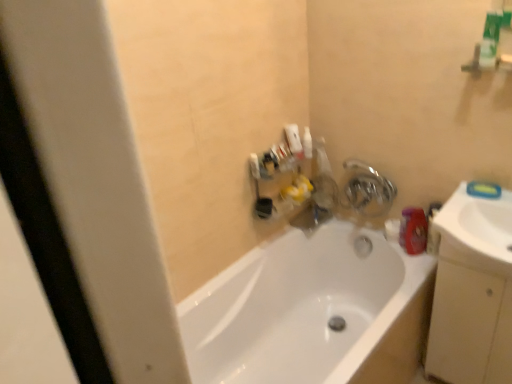
Image resolution: width=512 pixels, height=384 pixels. I want to click on metallic silver faucet at upper right, so click(367, 190).

This screenshot has height=384, width=512. What do you see at coordinates (311, 218) in the screenshot?
I see `matte plastic faucet at upper center` at bounding box center [311, 218].

Measure the distance between beige matte cabinet at right and camera.

The distance of beige matte cabinet at right from camera is 4.63 feet.

Find the location of a particular element. This screenshot has width=512, height=384. white glossy bathtub at center is located at coordinates (310, 313).

From the image's perspective, which is above, metallic silver faucet at upper right or matte plastic faucet at upper center?

metallic silver faucet at upper right appears higher in the image.

Are metallic silver faucet at upper right and matte plastic faucet at upper center located far from each other?

No, there isn't a large distance between metallic silver faucet at upper right and matte plastic faucet at upper center.

Which of these two, metallic silver faucet at upper right or matte plastic faucet at upper center, is smaller?

Smaller between the two is matte plastic faucet at upper center.

Between metallic silver faucet at upper right and matte plastic faucet at upper center, which one is positioned behind?

matte plastic faucet at upper center is further from the camera.

You are a GUI agent. You are given a task and a screenshot of the screen. Output one action in this format:
    pyautogui.click(x=<x>, y=<y>)
    Task: Click on the tap above the white glossy bathtub at center (from the image's perspective)
    This screenshot has width=512, height=384.
    Given the screenshot: What is the action you would take?
    pyautogui.click(x=367, y=190)

Is metallic silver faucet at upper right facing away from white glossy bathtub at center?

That's not correct — metallic silver faucet at upper right is not looking away from white glossy bathtub at center.

Is white glossy bathtub at center inside metallic silver faucet at upper right?

No, metallic silver faucet at upper right does not contain white glossy bathtub at center.

What's the angular difference between metallic silver faucet at upper right and white glossy bathtub at center's facing directions?

metallic silver faucet at upper right and white glossy bathtub at center are facing 91 degrees away from each other.

I want to click on bathtub on the left of beige matte cabinet at right, so click(310, 313).

Does point (294, 349) lie in front of point (429, 336)?

No.

How distant is white glossy bathtub at center from beige matte cabinet at right?

white glossy bathtub at center is 15.39 inches away from beige matte cabinet at right.

Considering the sizes of white glossy bathtub at center and beige matte cabinet at right in the image, is white glossy bathtub at center wider or thinner than beige matte cabinet at right?

Considering their sizes, white glossy bathtub at center looks broader than beige matte cabinet at right.

Considering the sizes of objects white glossy bathtub at center and metallic silver faucet at upper right in the image provided, who is taller, white glossy bathtub at center or metallic silver faucet at upper right?

white glossy bathtub at center.

From the image's perspective, is white glossy bathtub at center beneath metallic silver faucet at upper right?

Indeed, from the image's perspective, white glossy bathtub at center is shown beneath metallic silver faucet at upper right.

Considering the sizes of objects white glossy bathtub at center and metallic silver faucet at upper right in the image provided, who is smaller, white glossy bathtub at center or metallic silver faucet at upper right?

metallic silver faucet at upper right.

Considering the positions of objects matte plastic faucet at upper center and beige matte cabinet at right in the image provided, who is behind, matte plastic faucet at upper center or beige matte cabinet at right?

matte plastic faucet at upper center is behind.

Is point (312, 213) farther from viewer compared to point (490, 310)?

Yes, it is behind point (490, 310).

Between matte plastic faucet at upper center and beige matte cabinet at right, which one has less height?

Standing shorter between the two is matte plastic faucet at upper center.

From the image's perspective, who appears lower, matte plastic faucet at upper center or beige matte cabinet at right?

beige matte cabinet at right.

How many degrees apart are the facing directions of beige matte cabinet at right and white glossy bathtub at center?

90 degrees separate the facing orientations of beige matte cabinet at right and white glossy bathtub at center.

From the picture: Considering the relative sizes of beige matte cabinet at right and white glossy bathtub at center in the image provided, is beige matte cabinet at right wider than white glossy bathtub at center?

Incorrect, the width of beige matte cabinet at right does not surpass that of white glossy bathtub at center.

Is beige matte cabinet at right looking in the opposite direction of white glossy bathtub at center?

No, beige matte cabinet at right is not facing the opposite direction of white glossy bathtub at center.

Between white glossy sink at right and white glossy bathtub at center, which one has larger size?

white glossy bathtub at center.

From the image's perspective, is white glossy sink at right located above or below white glossy bathtub at center?

Based on their image positions, white glossy sink at right is located above white glossy bathtub at center.

Is white glossy sink at right surrounding white glossy bathtub at center?

No, white glossy bathtub at center is located outside of white glossy sink at right.

Locate an element on the screen. The height and width of the screenshot is (384, 512). plumbing fixture behind the metallic silver faucet at upper right is located at coordinates (311, 218).

The height and width of the screenshot is (384, 512). I want to click on tap on the right of the white glossy bathtub at center, so click(367, 190).

Based on their spatial positions, is beige matte cabinet at right or matte plastic faucet at upper center further from white glossy sink at right?

Based on the image, matte plastic faucet at upper center appears to be further to white glossy sink at right.

When comparing their distances from metallic silver faucet at upper right, does white glossy bathtub at center or beige matte cabinet at right seem further?

beige matte cabinet at right lies further to metallic silver faucet at upper right than the other object.

From the image, which object appears to be nearer to white glossy bathtub at center, beige matte cabinet at right or metallic silver faucet at upper right?

Based on the image, beige matte cabinet at right appears to be nearer to white glossy bathtub at center.

Estimate the real-world distances between objects in this image. Which object is further from white glossy bathtub at center, white glossy sink at right or metallic silver faucet at upper right?

Based on the image, metallic silver faucet at upper right appears to be further to white glossy bathtub at center.

Looking at this image, which object lies further to the anchor point white glossy sink at right, metallic silver faucet at upper right or white glossy bathtub at center?

white glossy bathtub at center is positioned further to the anchor white glossy sink at right.

Based on their spatial positions, is white glossy bathtub at center or matte plastic faucet at upper center closer to white glossy sink at right?

Based on the image, white glossy bathtub at center appears to be nearer to white glossy sink at right.

Estimate the real-world distances between objects in this image. Which object is closer to matte plastic faucet at upper center, white glossy bathtub at center or metallic silver faucet at upper right?

Based on the image, metallic silver faucet at upper right appears to be nearer to matte plastic faucet at upper center.

Considering their positions, is metallic silver faucet at upper right positioned closer to white glossy bathtub at center than matte plastic faucet at upper center?

matte plastic faucet at upper center is positioned closer to the anchor white glossy bathtub at center.

The width and height of the screenshot is (512, 384). Find the location of `sink located between white glossy bathtub at center and metallic silver faucet at upper right in the depth direction`. sink located between white glossy bathtub at center and metallic silver faucet at upper right in the depth direction is located at coordinates (474, 232).

You are a GUI agent. You are given a task and a screenshot of the screen. Output one action in this format:
    pyautogui.click(x=<x>, y=<y>)
    Task: Click on the sink between white glossy bathtub at center and matte plastic faucet at upper center in the front-back direction
    The height and width of the screenshot is (384, 512).
    Given the screenshot: What is the action you would take?
    pyautogui.click(x=474, y=232)

What are the coordinates of `drawer between white glossy sink at right and matte plastic faucet at upper center in the front-back direction` in the screenshot? It's located at (462, 323).

Image resolution: width=512 pixels, height=384 pixels. What are the coordinates of `drawer positioned between white glossy sink at right and metallic silver faucet at upper right from near to far` in the screenshot? It's located at (462, 323).